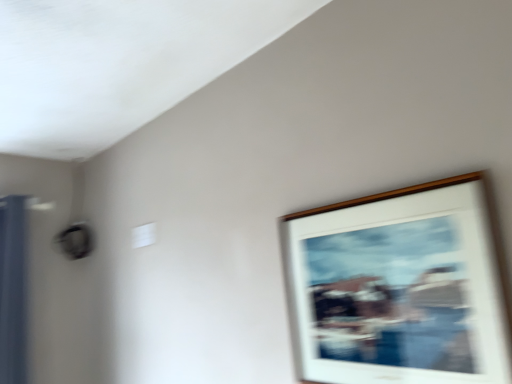
Question: Is white matte picture frame at upper right bigger or smaller than blue fabric curtain at left?

Choices:
 (A) big
 (B) small

Answer: (B)

Question: Considering the relative positions of white matte picture frame at upper right and blue fabric curtain at left in the image provided, is white matte picture frame at upper right to the left or to the right of blue fabric curtain at left?

Choices:
 (A) left
 (B) right

Answer: (B)

Question: Considering their positions, is white matte picture frame at upper right located in front of or behind blue fabric curtain at left?

Choices:
 (A) behind
 (B) front

Answer: (B)

Question: From a real-world perspective, is blue fabric curtain at left positioned above or below white matte picture frame at upper right?

Choices:
 (A) above
 (B) below

Answer: (A)

Question: Based on their sizes in the image, would you say blue fabric curtain at left is bigger or smaller than white matte picture frame at upper right?

Choices:
 (A) small
 (B) big

Answer: (B)

Question: Is blue fabric curtain at left taller or shorter than white matte picture frame at upper right?

Choices:
 (A) short
 (B) tall

Answer: (B)

Question: Is blue fabric curtain at left in front of or behind white matte picture frame at upper right in the image?

Choices:
 (A) behind
 (B) front

Answer: (A)